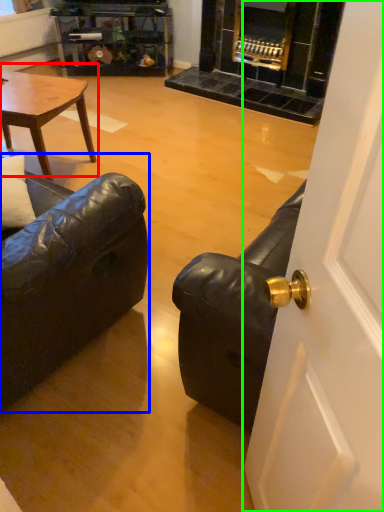
Question: Considering the real-world distances, which object is farthest from coffee table (highlighted by a red box)? studio couch (highlighted by a blue box) or door (highlighted by a green box)?

Choices:
 (A) studio couch
 (B) door

Answer: (B)